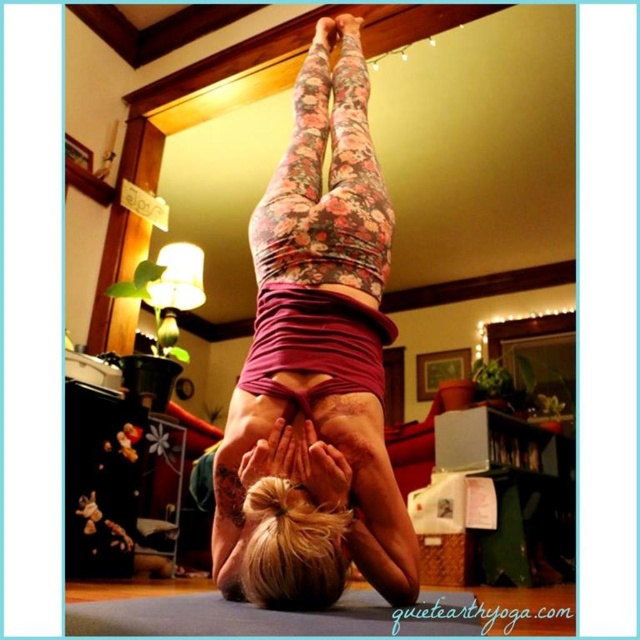
You are standing in the room and want to place a small sticker on the point that is closer to you. Which point should you choose between point (404,509) and point (92,608)?

Point (92,608) is closer to you, so you should place the sticker there.

You are designing a storage box for the items in the image. The floral leggings at center and blue rubber yoga mat at center need to be stored. Which item requires a wider storage space?

The blue rubber yoga mat at center requires a wider storage space because its width is greater than the floral leggings at center.